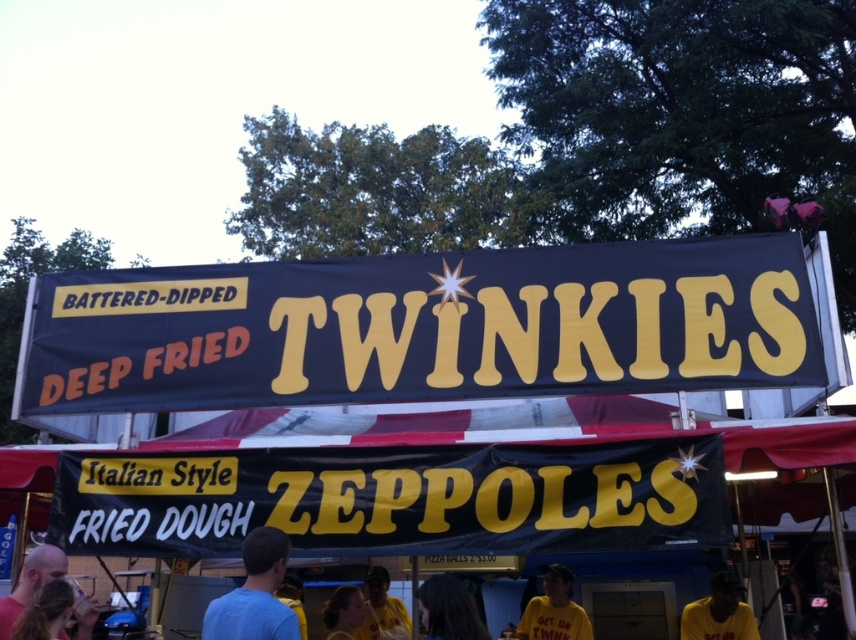
Question: Among these points, which one is nearest to the camera?

Choices:
 (A) coord(712,627)
 (B) coord(580,618)
 (C) coord(355,632)

Answer: (A)

Question: Which point is farther from the camera taking this photo?

Choices:
 (A) (212, 632)
 (B) (33, 561)
 (C) (522, 636)
 (D) (384, 620)

Answer: (D)

Question: Considering the real-world distances, which object is closest to the blue fabric signboard at center?

Choices:
 (A) black matte signboard at center
 (B) blue shirt at center

Answer: (A)

Question: Does blue shirt at center appear over yellow shirt at center?

Choices:
 (A) yes
 (B) no

Answer: (A)

Question: Can you confirm if blue shirt at center is smaller than yellow fabric shirt at lower center?

Choices:
 (A) no
 (B) yes

Answer: (B)

Question: Is blue fabric signboard at center below yellow fabric shirt at lower center?

Choices:
 (A) no
 (B) yes

Answer: (A)